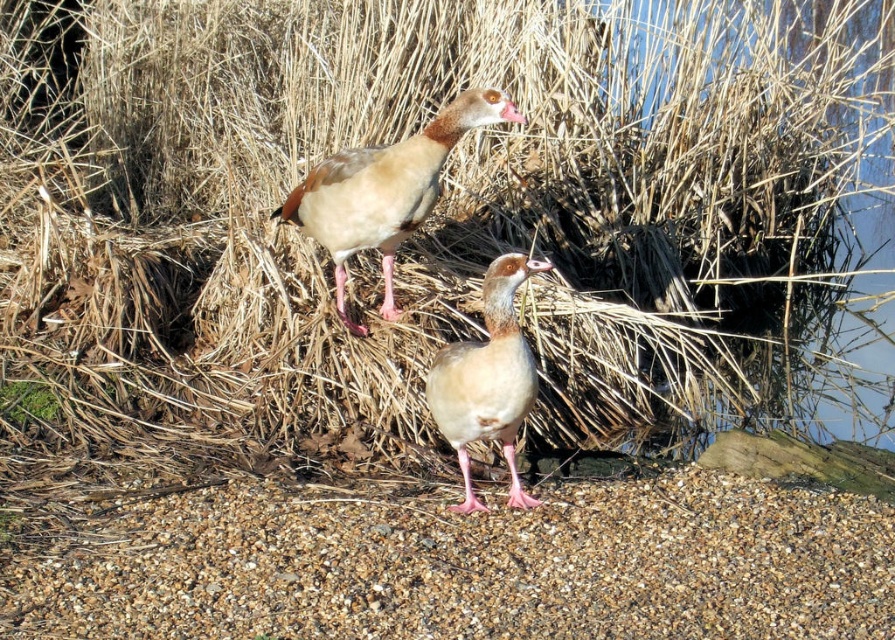
What do you see at coordinates (384, 189) in the screenshot? I see `brown feathered duck at upper center` at bounding box center [384, 189].

The width and height of the screenshot is (895, 640). What are the coordinates of `brown feathered duck at upper center` in the screenshot? It's located at (384, 189).

Measure the distance between point [391,195] and camera.

Point [391,195] and camera are 4.77 meters apart from each other.

Find the location of a particular element. The width and height of the screenshot is (895, 640). brown feathered duck at upper center is located at coordinates (384, 189).

Is brown gravel at lower center closer to the viewer compared to brown feathered duck at center?

Yes.

In the scene shown: Can you confirm if brown gravel at lower center is smaller than brown feathered duck at center?

Incorrect, brown gravel at lower center is not smaller in size than brown feathered duck at center.

Does point (736, 561) come farther from viewer compared to point (450, 385)?

No, it is in front of (450, 385).

Image resolution: width=895 pixels, height=640 pixels. Identify the location of brown gravel at lower center. (467, 564).

Can you confirm if brown gravel at lower center is positioned below brown feathered duck at upper center?

Indeed, brown gravel at lower center is positioned under brown feathered duck at upper center.

Looking at this image, is brown gravel at lower center smaller than brown feathered duck at upper center?

Yes, brown gravel at lower center is smaller than brown feathered duck at upper center.

This screenshot has height=640, width=895. In order to click on brown gravel at lower center in this screenshot , I will do `click(467, 564)`.

Identify the location of brown gravel at lower center. The width and height of the screenshot is (895, 640). (467, 564).